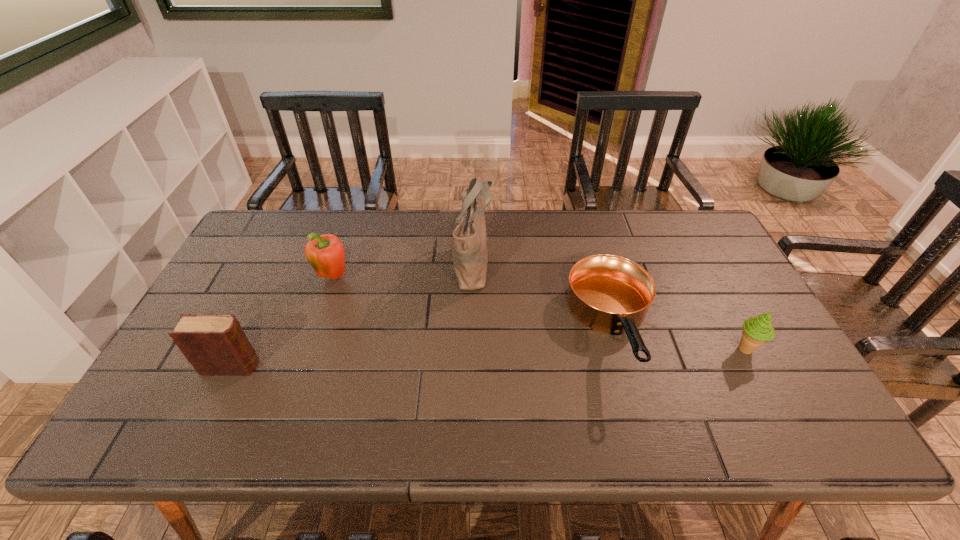
In order to click on free area in between the second object from right to left and the diary in this screenshot , I will do `click(422, 347)`.

Locate an element on the screen. The height and width of the screenshot is (540, 960). vacant area that lies between the frying pan and the diary is located at coordinates (422, 347).

Where is `vacant point located between the fourth object from right to left and the rightmost object`? The height and width of the screenshot is (540, 960). vacant point located between the fourth object from right to left and the rightmost object is located at coordinates (540, 313).

Image resolution: width=960 pixels, height=540 pixels. I want to click on vacant area that lies between the frying pan and the third object from right to left, so coord(542,295).

Image resolution: width=960 pixels, height=540 pixels. I want to click on free space between the pepper and the frying pan, so click(473, 302).

Image resolution: width=960 pixels, height=540 pixels. Identify the location of free spot between the rightmost object and the fourth object from left to right. (679, 339).

The image size is (960, 540). Identify the location of object that can be found as the closest to the rightmost object. (x=607, y=293).

Identify which object is located as the nearest to the fourth object from left to right. Please provide its 2D coordinates. Your answer should be formatted as a tuple, i.e. [(x, y)], where the tuple contains the x and y coordinates of a point satisfying the conditions above.

[(757, 330)]

You are a GUI agent. You are given a task and a screenshot of the screen. Output one action in this format:
    pyautogui.click(x=<x>, y=<y>)
    Task: Click on the free space that satisfies the following two spatial constraints: 1. on the front-facing side of the third object from right to left; 2. on the right side of the rightmost object
    This screenshot has width=960, height=540.
    Given the screenshot: What is the action you would take?
    pyautogui.click(x=471, y=349)

At what (x,y) coordinates should I click in order to perform the action: click on free space that satisfies the following two spatial constraints: 1. on the handle side of the fourth object from left to right; 2. on the right side of the icecream. Please return your answer as a coordinate pair (x, y). Looking at the image, I should click on (618, 349).